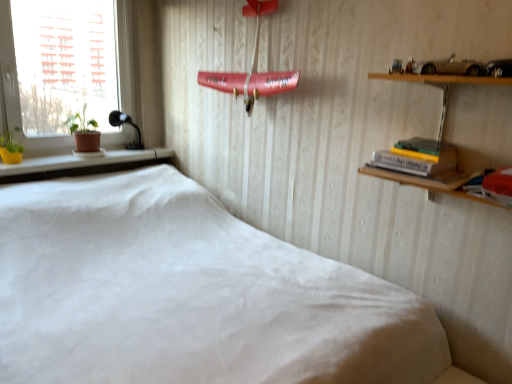
At what (x,y) coordinates should I click in order to perform the action: click on hardcover book at upper right, which is the second book in right-to-left order. Please return your answer as a coordinate pair (x, y). This screenshot has width=512, height=384. Looking at the image, I should click on (417, 157).

This screenshot has width=512, height=384. I want to click on white fabric bed at center, so click(x=190, y=295).

Is yellow matte flower pot at left bigger than black glass lamp at left?

Yes.

From a real-world perspective, is yellow matte flower pot at left positioned over black glass lamp at left based on gravity?

No, from a real-world perspective, yellow matte flower pot at left is not above black glass lamp at left.

Identify the location of window sill on the left side of black glass lamp at left. (81, 165).

From the picture: Does yellow matte flower pot at left turn towards black glass lamp at left?

No.

Are yellow matte plant at left and black glass lamp at left beside each other?

There is a gap between yellow matte plant at left and black glass lamp at left.

Is yellow matte plant at left in front of black glass lamp at left?

That is True.

Based on the photo, from the image's perspective, which one is positioned higher, yellow matte plant at left or black glass lamp at left?

black glass lamp at left is shown above in the image.

Does yellow matte plant at left have a lesser width compared to black glass lamp at left?

In fact, yellow matte plant at left might be wider than black glass lamp at left.

Considering the sizes of objects yellow matte plant at left and white plastic window at left in the image provided, who is bigger, yellow matte plant at left or white plastic window at left?

Bigger between the two is white plastic window at left.

Which is behind, yellow matte plant at left or white plastic window at left?

yellow matte plant at left is further from the camera.

Which object is positioned more to the right, yellow matte plant at left or white plastic window at left?

white plastic window at left.

Between yellow matte plant at left and white plastic window at left, which one has larger width?

yellow matte plant at left is wider.

Can you tell me how much white plastic window at left and yellow matte plant at left differ in facing direction?

1.71 degrees.

Looking at this image, is white plastic window at left smaller than yellow matte plant at left?

No, white plastic window at left is not smaller than yellow matte plant at left.

Based on the photo, between white plastic window at left and yellow matte plant at left, which one is positioned in front?

white plastic window at left is closer to the camera.

From the image's perspective, which is above, white plastic window at left or yellow matte plant at left?

white plastic window at left appears higher in the image.

Consider the image. Is hardcover book at upper right, which is counted as the 1th book, starting from the left, in front of yellow matte plant at left?

Yes.

Based on their sizes in the image, would you say hardcover book at upper right, which is counted as the 1th book, starting from the left, is bigger or smaller than yellow matte plant at left?

Considering their sizes, hardcover book at upper right, which is counted as the 1th book, starting from the left, takes up more space than yellow matte plant at left.

Between hardcover book at upper right, which is the second book in right-to-left order, and yellow matte plant at left, which one appears on the left side from the viewer's perspective?

Positioned to the left is yellow matte plant at left.

How far apart are hardcover book at upper right, which is the second book in right-to-left order, and yellow matte plant at left?

A distance of 7.89 feet exists between hardcover book at upper right, which is the second book in right-to-left order, and yellow matte plant at left.

Which is in front, point (486, 193) or point (390, 158)?

The point (486, 193) is closer to the camera.

Is matte red book at right, positioned as the second book in back-to-front order, not within hardcover book at upper right, the 1th book viewed from the back?

matte red book at right, positioned as the second book in back-to-front order, lies outside hardcover book at upper right, the 1th book viewed from the back,'s area.

Based on their positions, is matte red book at right, the second book from the left, located to the left or right of hardcover book at upper right, the 1th book viewed from the back?

matte red book at right, the second book from the left, is to the right of hardcover book at upper right, the 1th book viewed from the back.

Considering the points (6, 132) and (116, 164), which point is behind, point (6, 132) or point (116, 164)?

The point (6, 132) is farther from the camera.

Considering the relative sizes of yellow matte plant at left and yellow matte flower pot at left in the image provided, is yellow matte plant at left wider than yellow matte flower pot at left?

In fact, yellow matte plant at left might be narrower than yellow matte flower pot at left.

From the picture: Is yellow matte flower pot at left located within yellow matte plant at left?

No.

Locate an element on the screen. The width and height of the screenshot is (512, 384). lamp lying on the right of yellow matte flower pot at left is located at coordinates (x=126, y=123).

The width and height of the screenshot is (512, 384). Find the location of `plant that appears on the left of black glass lamp at left`. plant that appears on the left of black glass lamp at left is located at coordinates (10, 143).

Which object lies further to the anchor point white fabric bed at center, matte red book at right, the second book from the left, or black glass lamp at left?

Among the two, black glass lamp at left is located further to white fabric bed at center.

Based on their spatial positions, is hardcover book at upper right, the second book viewed from the front, or black glass lamp at left further from white fabric bed at center?

black glass lamp at left.

From the image, which object appears to be nearer to matte red book at right, acting as the 1th book starting from the right, yellow matte plant at left or white fabric bed at center?

white fabric bed at center is closer to matte red book at right, acting as the 1th book starting from the right.

Which object lies further to the anchor point hardcover book at upper right, the second book viewed from the front, white fabric bed at center or yellow matte flower pot at left?

The object further to hardcover book at upper right, the second book viewed from the front, is yellow matte flower pot at left.

Based on their spatial positions, is matte red book at right, positioned as the second book in back-to-front order, or white fabric bed at center further from black glass lamp at left?

matte red book at right, positioned as the second book in back-to-front order, lies further to black glass lamp at left than the other object.

Looking at the image, which one is located closer to yellow matte flower pot at left, black glass lamp at left or yellow matte plant at left?

black glass lamp at left lies closer to yellow matte flower pot at left than the other object.

Considering their positions, is black glass lamp at left positioned closer to white plastic window at left than yellow matte flower pot at left?

black glass lamp at left lies closer to white plastic window at left than the other object.

Which object lies nearer to the anchor point yellow matte plant at left, white plastic window at left or white fabric bed at center?

The object closer to yellow matte plant at left is white plastic window at left.

You are a GUI agent. You are given a task and a screenshot of the screen. Output one action in this format:
    pyautogui.click(x=<x>, y=<y>)
    Task: Click on the plant positioned between white fabric bed at center and black glass lamp at left from near to far
    This screenshot has width=512, height=384.
    Given the screenshot: What is the action you would take?
    pyautogui.click(x=10, y=143)

This screenshot has width=512, height=384. I want to click on lamp located between yellow matte flower pot at left and hardcover book at upper right, which is the second book in right-to-left order, in the left-right direction, so click(x=126, y=123).

Where is `window sill between white plastic window at left and hardcover book at upper right, the 1th book viewed from the back`? This screenshot has height=384, width=512. window sill between white plastic window at left and hardcover book at upper right, the 1th book viewed from the back is located at coordinates (81, 165).

At what (x,y) coordinates should I click in order to perform the action: click on window sill between yellow matte plant at left and matte red book at right, the second book from the left, in the horizontal direction. Please return your answer as a coordinate pair (x, y). The image size is (512, 384). Looking at the image, I should click on (81, 165).